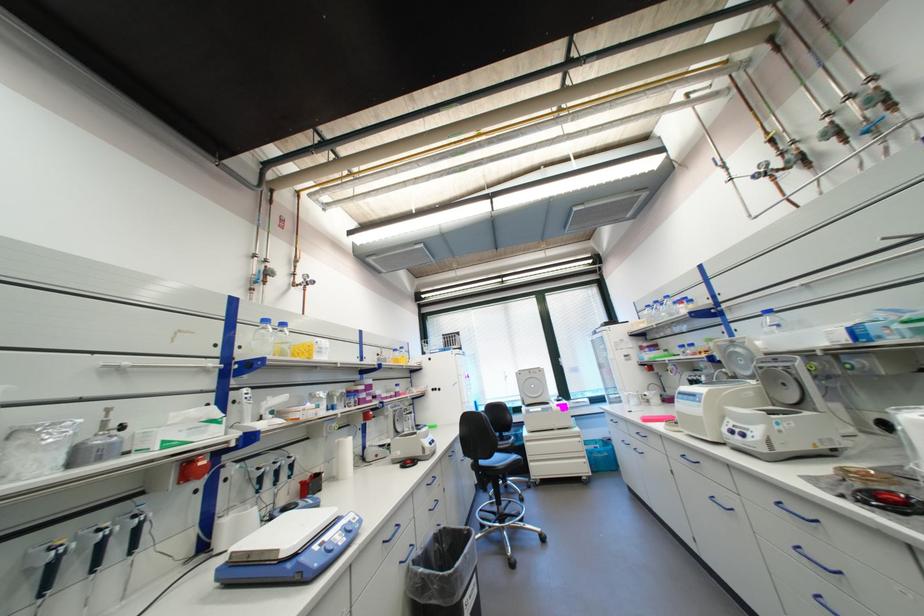
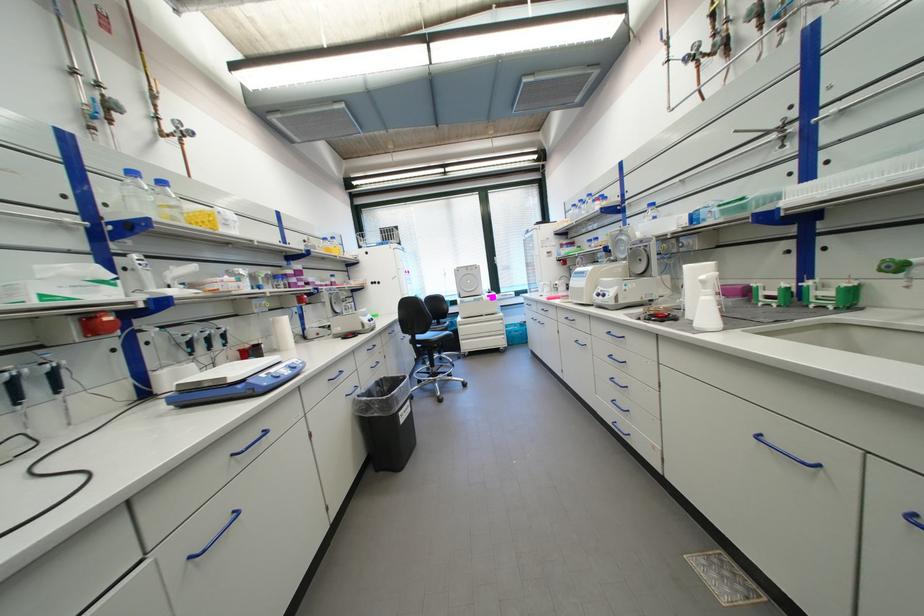
Based on the photo, what movement of the cameraman would produce the second image?

The cameraman moved toward right, backward.